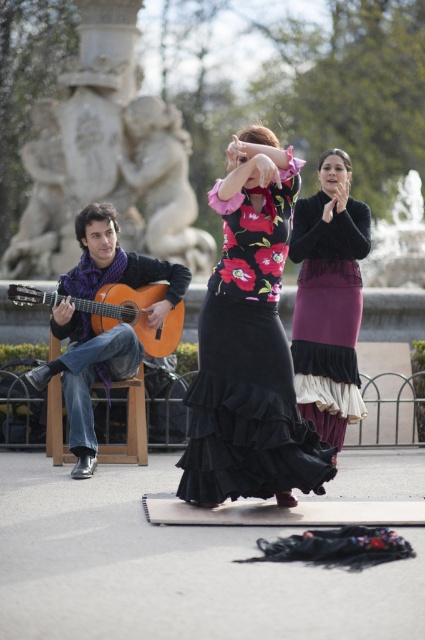
Based on the scene description, which object is shorter between the black satin dress at center and the velvet purple skirt at center?

The black satin dress at center is shorter than the velvet purple skirt at center.

You are a photographer planning to capture a closeup shot of the velvet purple skirt at center and the orange wood guitar at left. Given that your camera can only focus on one object at a time, which object should you choose to ensure the other remains in the background?

The velvet purple skirt at center is thinner than the orange wood guitar at left, so you should focus on the orange wood guitar at left to keep the velvet purple skirt at center in the background.